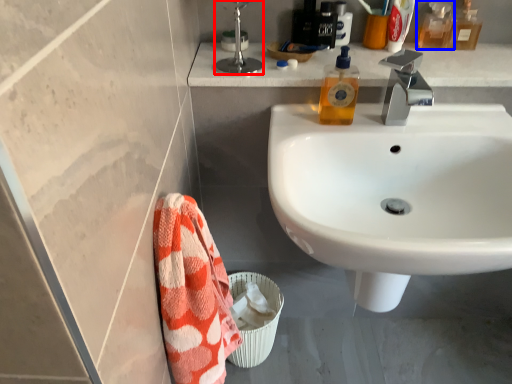
Question: Which of the following is the farthest to the observer, plumbing fixture (highlighted by a red box) or mouthwash (highlighted by a blue box)?

Choices:
 (A) plumbing fixture
 (B) mouthwash

Answer: (B)